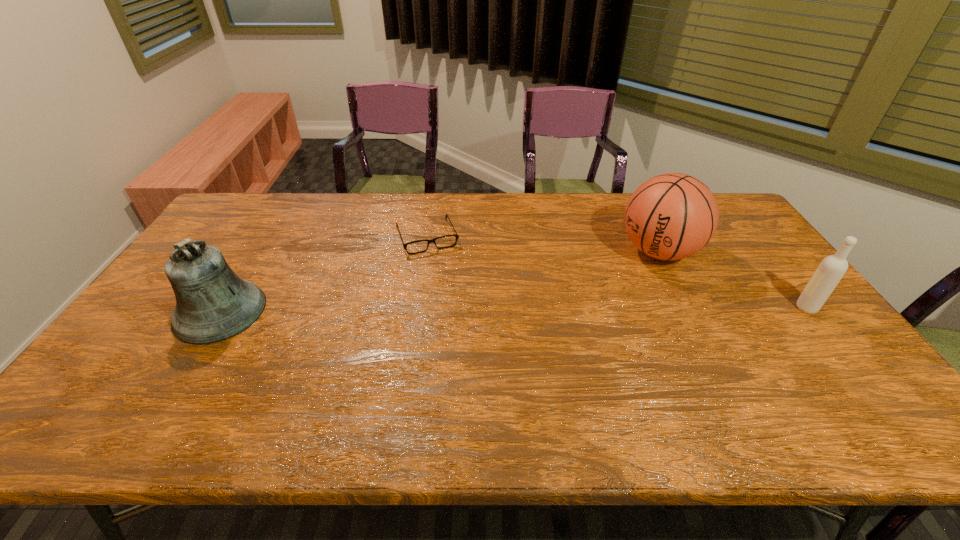
This screenshot has height=540, width=960. Identify the location of the leftmost object. (213, 304).

Find the location of a particular element. The width and height of the screenshot is (960, 540). vodka is located at coordinates (832, 268).

Where is `the second object from left to right`? the second object from left to right is located at coordinates (456, 235).

Image resolution: width=960 pixels, height=540 pixels. Identify the location of the shortest object. (456, 235).

I want to click on basketball, so click(x=671, y=216).

Where is `free space located 0.360m on the back of the bell`? The image size is (960, 540). free space located 0.360m on the back of the bell is located at coordinates (279, 216).

In order to click on vacant region located 0.180m on the back of the vodka in this screenshot , I will do (x=770, y=261).

At what (x,y) coordinates should I click in order to perform the action: click on free region located 0.120m on the front-facing side of the shortest object. Please return your answer as a coordinate pair (x, y). The height and width of the screenshot is (540, 960). Looking at the image, I should click on (444, 279).

Find the location of `vacant area situated 0.140m on the front-facing side of the shortest object`. vacant area situated 0.140m on the front-facing side of the shortest object is located at coordinates click(x=445, y=282).

Identify the location of free spot located 0.290m on the front-facing side of the shortest object. The width and height of the screenshot is (960, 540). (459, 318).